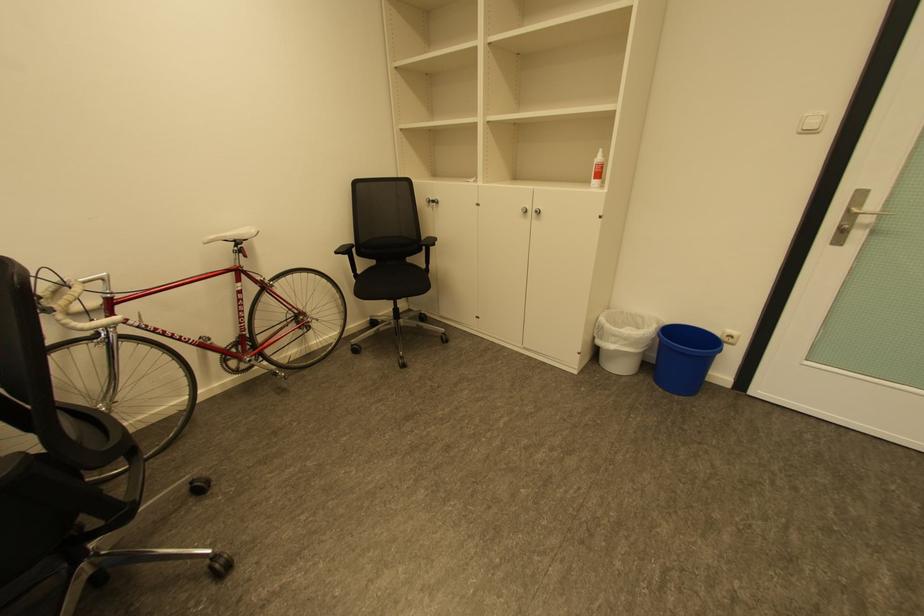
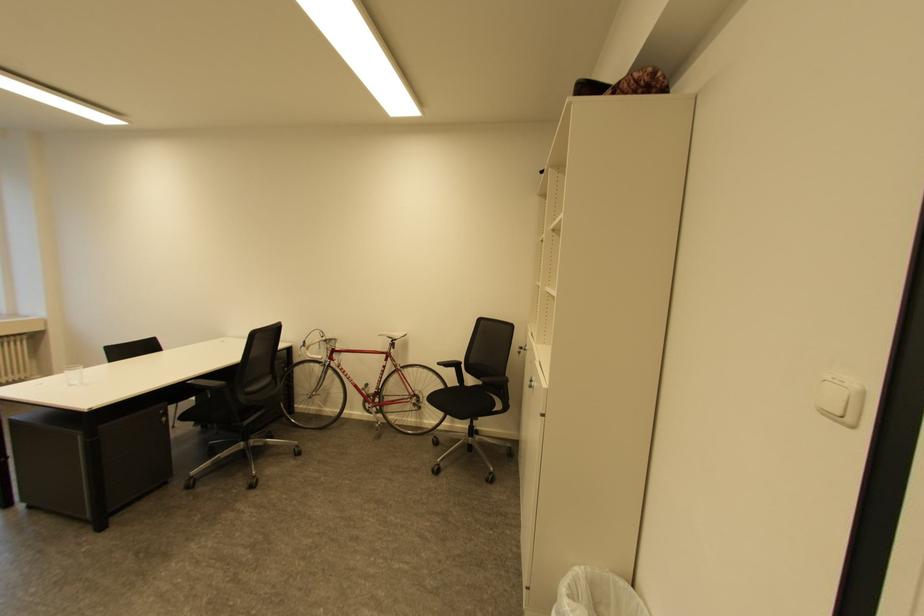
In the second image, find the point that corresponds to (241,241) in the first image.

(398, 339)